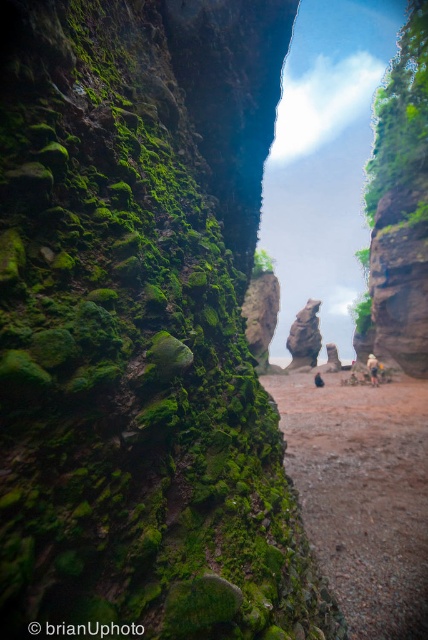
You are standing at the point marked by point (362,493) in the image. Looking towards the mossy rock formation, what direction do you need to walk to reach the sandy path leading towards the rock formations?

The point (362,493) marks the brown gravel path at center, so you are already standing on the sandy path leading towards the rock formations.

You are standing at the entrance of the scenic area and see the brown gravel path at center. If you want to reach the mossy rock formation in the foreground, should you walk towards the path or away from it?

You should walk away from the brown gravel path at center because the mossy rock formation in the foreground is closer to you than the path.

You are hiking along the brown gravel path at center and want to reach the top of the rusty stone rock at center. Is the path directly below the rock a feasible route to climb it?

The brown gravel path at center is positioned under rusty stone rock at center, so yes, the path directly below the rock is a feasible route to climb it.